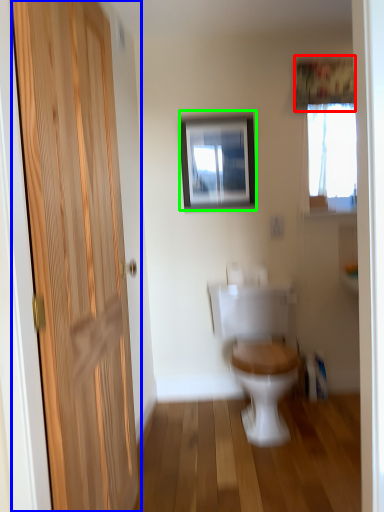
Question: Which object is the farthest from curtain (highlighted by a red box)? Choose among these: door (highlighted by a blue box) or picture frame (highlighted by a green box).

Choices:
 (A) door
 (B) picture frame

Answer: (A)